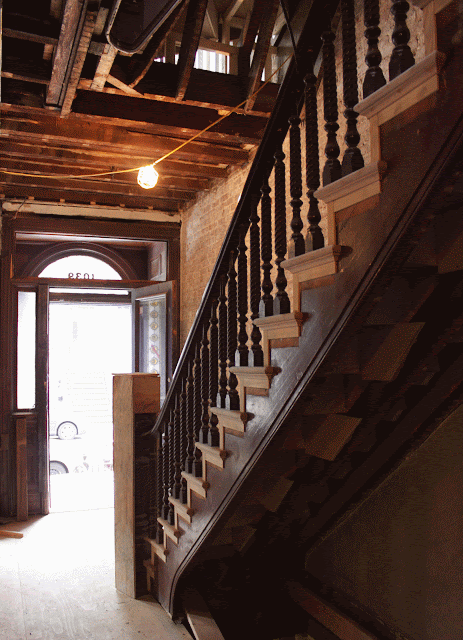
Identify the location of door. (172, 288).